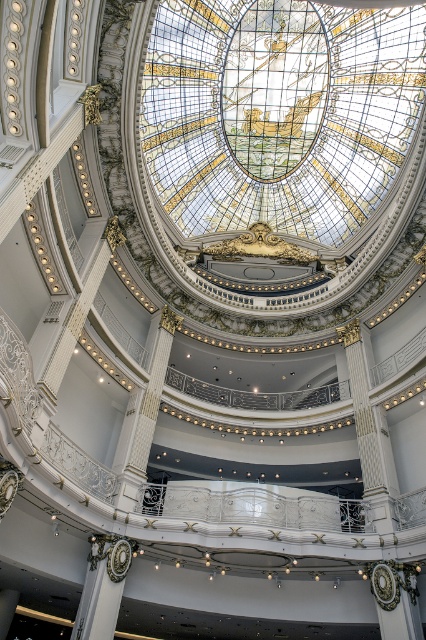
You are an interior designer planning to place a large sculpture in the center of the grand space. Given the presence of the gold ornate column at center and the white marble column at center, which column should you avoid placing the sculpture near to ensure there is enough space?

You should avoid placing the sculpture near the gold ornate column at center because it occupies less space than the white marble column at center, leaving more room around it for the sculpture.

You are standing in the center of this grand space and notice two columns. Which one is positioned to the left when facing the gold ornate column at center and the white marble column at center?

The gold ornate column at center is positioned to the left of the white marble column at center.